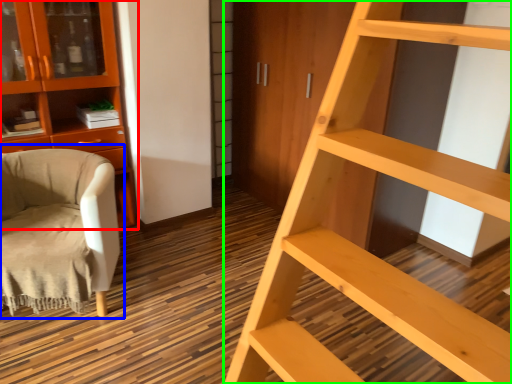
Question: Which is farther away from cabinetry (highlighted by a red box)? chair (highlighted by a blue box) or ladder (highlighted by a green box)?

Choices:
 (A) chair
 (B) ladder

Answer: (B)